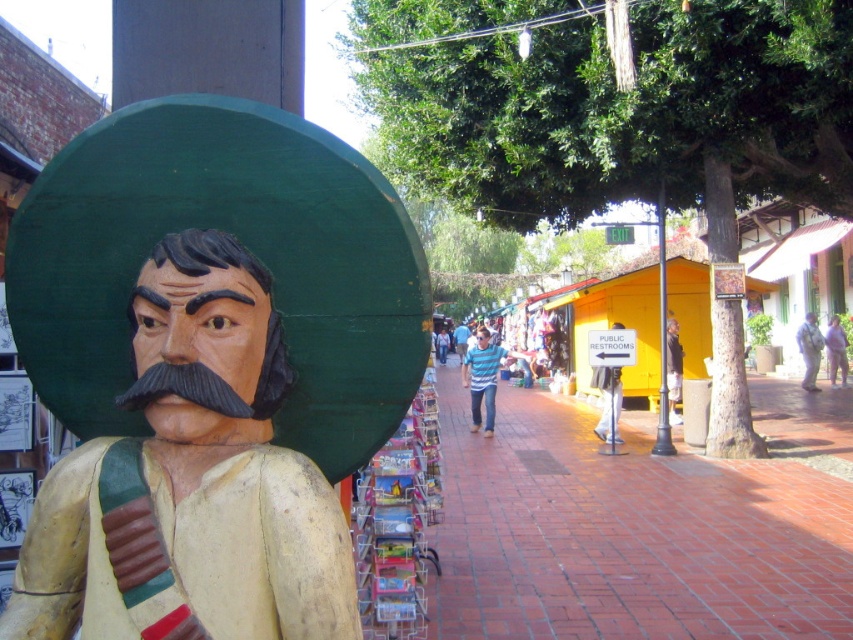
Question: Considering the relative positions of wooden statue at left and striped cotton shirt at center in the image provided, where is wooden statue at left located with respect to striped cotton shirt at center?

Choices:
 (A) above
 (B) below

Answer: (A)

Question: Is brick pavement at center behind white fabric bag at center?

Choices:
 (A) yes
 (B) no

Answer: (B)

Question: Which point is closer to the camera?

Choices:
 (A) (618, 540)
 (B) (476, 344)

Answer: (A)

Question: Based on their relative distances, which object is nearer to the brick pavement at center?

Choices:
 (A) striped cotton shirt at center
 (B) white fabric bag at center
 (C) wooden statue at left
 (D) dark gray fabric jacket at center

Answer: (A)

Question: Estimate the real-world distances between objects in this image. Which object is closer to the brick pavement at center?

Choices:
 (A) light pink fabric at lower right
 (B) striped cotton shirt at center

Answer: (B)

Question: Is striped cotton shirt at center closer to camera compared to light pink fabric at lower right?

Choices:
 (A) yes
 (B) no

Answer: (A)